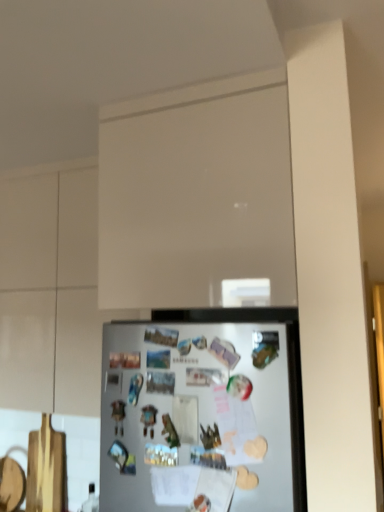
Question: Is white matte refrigerator at lower center taller or shorter than white matte glass door at upper center?

Choices:
 (A) short
 (B) tall

Answer: (A)

Question: Looking at their shapes, would you say white matte refrigerator at lower center is wider or thinner than white matte glass door at upper center?

Choices:
 (A) thin
 (B) wide

Answer: (A)

Question: Estimate the real-world distances between objects in this image. Which object is farther from the white matte glass door at upper center?

Choices:
 (A) white matte refrigerator at lower center
 (B) white matte cabinet at upper center

Answer: (B)

Question: Which object is positioned closest to the white matte glass door at upper center?

Choices:
 (A) white matte refrigerator at lower center
 (B) white matte cabinet at upper center

Answer: (A)